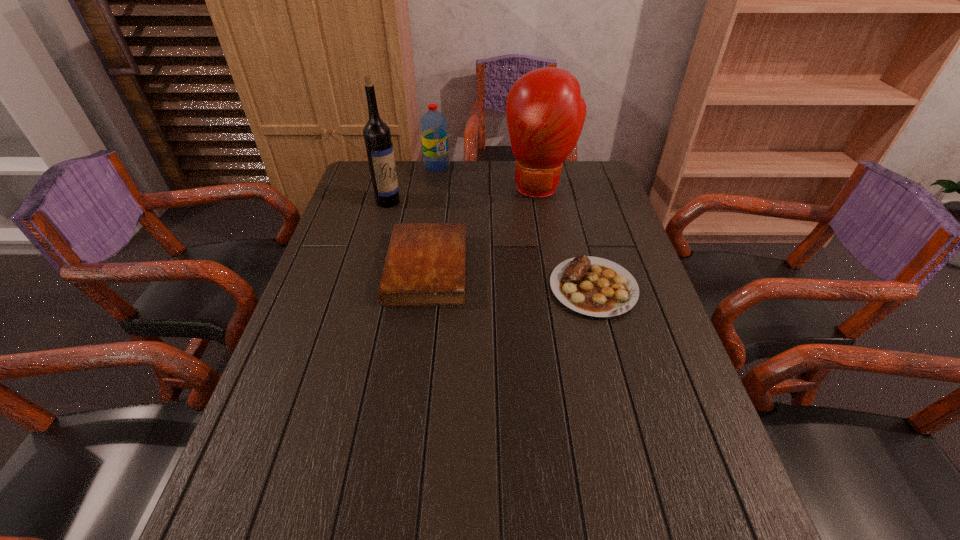
Where is `free spot on the desktop that is between the Bible and the steak and is positioned on the label of the wine bottle`? This screenshot has width=960, height=540. free spot on the desktop that is between the Bible and the steak and is positioned on the label of the wine bottle is located at coordinates (489, 275).

The width and height of the screenshot is (960, 540). What are the coordinates of `vacant space on the desktop that is between the Bible and the steak and is positioned on the striking surface of the boxing glove` in the screenshot? It's located at (533, 281).

Image resolution: width=960 pixels, height=540 pixels. In order to click on vacant space on the desktop that is between the Bible and the steak and is positioned on the front label of the third shortest object in this screenshot , I will do `click(520, 279)`.